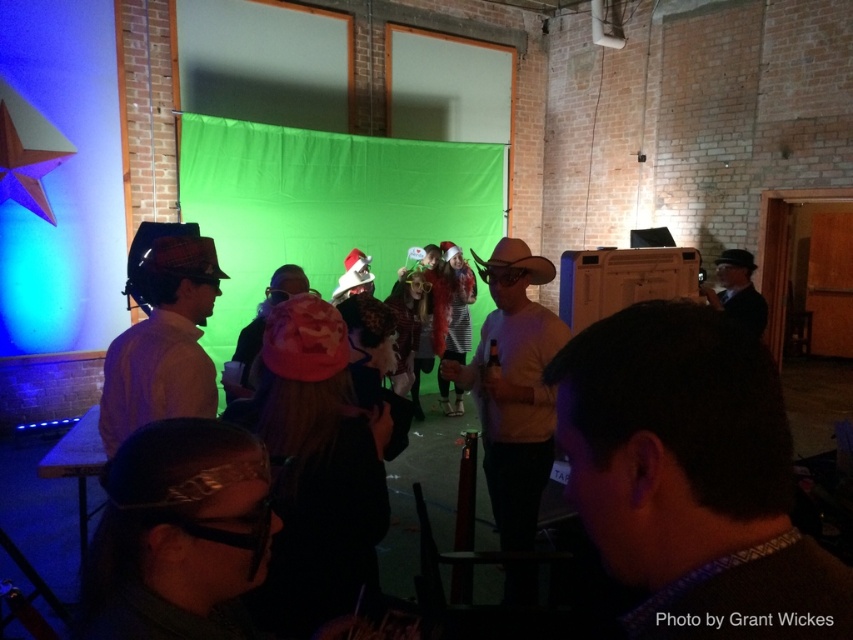
Question: Does blue matte star at left lie behind matte brown hat at left?

Choices:
 (A) yes
 (B) no

Answer: (A)

Question: Is brown fuzzy sweater at center bigger than shiny metallic headband at lower left?

Choices:
 (A) yes
 (B) no

Answer: (B)

Question: Is brown fuzzy sweater at center smaller than matte black suit at right?

Choices:
 (A) yes
 (B) no

Answer: (A)

Question: Which object is farther from the camera taking this photo?

Choices:
 (A) brown fuzzy sweater at center
 (B) matte brown hat at left

Answer: (B)

Question: Which point is farther to the camera?

Choices:
 (A) (730, 275)
 (B) (230, 586)
 (C) (122, 230)
 (D) (103, 404)

Answer: (C)

Question: Estimate the real-world distances between objects in this image. Which object is closer to the shiny metallic headband at lower left?

Choices:
 (A) matte brown hat at left
 (B) brown fuzzy sweater at center

Answer: (B)